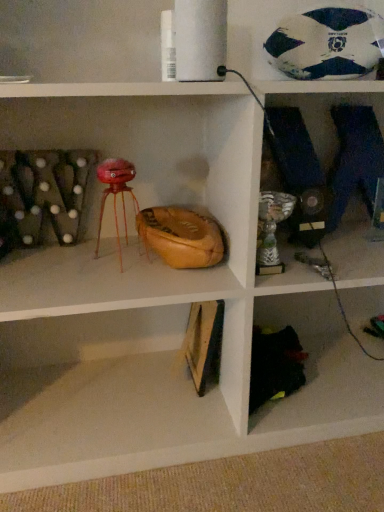
Question: Is wooden frame at lower center to the right of white and blue textured soccer ball at upper right from the viewer's perspective?

Choices:
 (A) no
 (B) yes

Answer: (A)

Question: Is wooden frame at lower center thinner than white and blue textured soccer ball at upper right?

Choices:
 (A) yes
 (B) no

Answer: (B)

Question: Is wooden frame at lower center positioned in front of white and blue textured soccer ball at upper right?

Choices:
 (A) no
 (B) yes

Answer: (B)

Question: Does wooden frame at lower center turn towards white and blue textured soccer ball at upper right?

Choices:
 (A) no
 (B) yes

Answer: (A)

Question: Considering the relative positions of wooden frame at lower center and white and blue textured soccer ball at upper right in the image provided, is wooden frame at lower center behind white and blue textured soccer ball at upper right?

Choices:
 (A) no
 (B) yes

Answer: (A)

Question: Does wooden frame at lower center have a larger size compared to white and blue textured soccer ball at upper right?

Choices:
 (A) no
 (B) yes

Answer: (B)

Question: From the image's perspective, is white and blue textured soccer ball at upper right located above wooden frame at lower center?

Choices:
 (A) no
 (B) yes

Answer: (B)

Question: Is white and blue textured soccer ball at upper right at the left side of wooden frame at lower center?

Choices:
 (A) yes
 (B) no

Answer: (B)

Question: Can you confirm if white and blue textured soccer ball at upper right is shorter than wooden frame at lower center?

Choices:
 (A) no
 (B) yes

Answer: (A)

Question: Can you confirm if white and blue textured soccer ball at upper right is thinner than wooden frame at lower center?

Choices:
 (A) no
 (B) yes

Answer: (B)

Question: Does white and blue textured soccer ball at upper right have a greater width compared to wooden frame at lower center?

Choices:
 (A) yes
 (B) no

Answer: (B)

Question: Is white and blue textured soccer ball at upper right aimed at wooden frame at lower center?

Choices:
 (A) no
 (B) yes

Answer: (A)

Question: Considering their positions, is white and blue textured soccer ball at upper right located in front of or behind wooden frame at lower center?

Choices:
 (A) behind
 (B) front

Answer: (A)